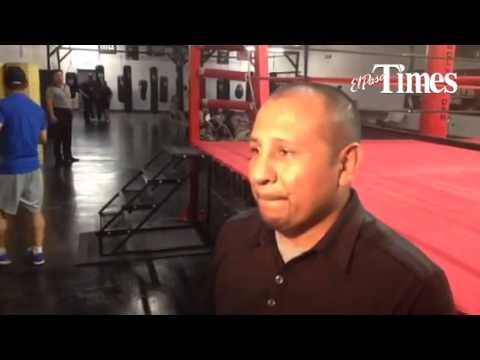
What are the coordinates of `bottom black stair` in the screenshot? It's located at (115, 225).